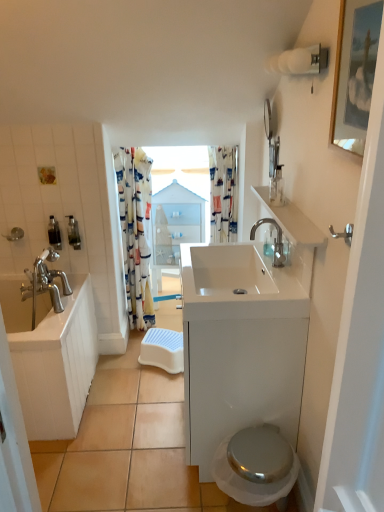
Question: Is silver metallic towel bar at upper right to the left of white glossy sink at upper right from the viewer's perspective?

Choices:
 (A) yes
 (B) no

Answer: (B)

Question: From the image's perspective, is silver metallic towel bar at upper right on top of white glossy sink at upper right?

Choices:
 (A) no
 (B) yes

Answer: (A)

Question: From a real-world perspective, is silver metallic towel bar at upper right under white glossy sink at upper right?

Choices:
 (A) no
 (B) yes

Answer: (A)

Question: Could you tell me if silver metallic towel bar at upper right is facing white glossy sink at upper right?

Choices:
 (A) no
 (B) yes

Answer: (A)

Question: Would you consider silver metallic towel bar at upper right to be distant from white glossy sink at upper right?

Choices:
 (A) no
 (B) yes

Answer: (A)

Question: Can you confirm if silver metallic towel bar at upper right is bigger than white glossy sink at upper right?

Choices:
 (A) yes
 (B) no

Answer: (B)

Question: From a real-world perspective, is clear glass jar at upper right, acting as the third toiletry starting from the left, positioned over metallic silver soap dispenser at left, which is the second toiletry in left-to-right order, based on gravity?

Choices:
 (A) no
 (B) yes

Answer: (B)

Question: From a real-world perspective, is clear glass jar at upper right, marked as the first toiletry in a front-to-back arrangement, beneath metallic silver soap dispenser at left, the 1th toiletry from the back?

Choices:
 (A) yes
 (B) no

Answer: (B)

Question: Can you confirm if clear glass jar at upper right, marked as the first toiletry in a front-to-back arrangement, is positioned to the left of metallic silver soap dispenser at left, the 1th toiletry from the back?

Choices:
 (A) yes
 (B) no

Answer: (B)

Question: Is clear glass jar at upper right, acting as the third toiletry starting from the left, smaller than metallic silver soap dispenser at left, marked as the third toiletry in a front-to-back arrangement?

Choices:
 (A) no
 (B) yes

Answer: (A)

Question: Is clear glass jar at upper right, acting as the third toiletry starting from the left, facing away from metallic silver soap dispenser at left, which is the second toiletry in left-to-right order?

Choices:
 (A) yes
 (B) no

Answer: (B)

Question: Considering the relative positions of clear glass jar at upper right, arranged as the first toiletry when viewed from the right, and metallic silver soap dispenser at left, the 1th toiletry from the back, in the image provided, is clear glass jar at upper right, arranged as the first toiletry when viewed from the right, behind metallic silver soap dispenser at left, the 1th toiletry from the back,?

Choices:
 (A) yes
 (B) no

Answer: (B)

Question: Considering the relative sizes of glossy glass mirror at upper right and satin nickel faucet at upper right in the image provided, is glossy glass mirror at upper right thinner than satin nickel faucet at upper right?

Choices:
 (A) no
 (B) yes

Answer: (B)